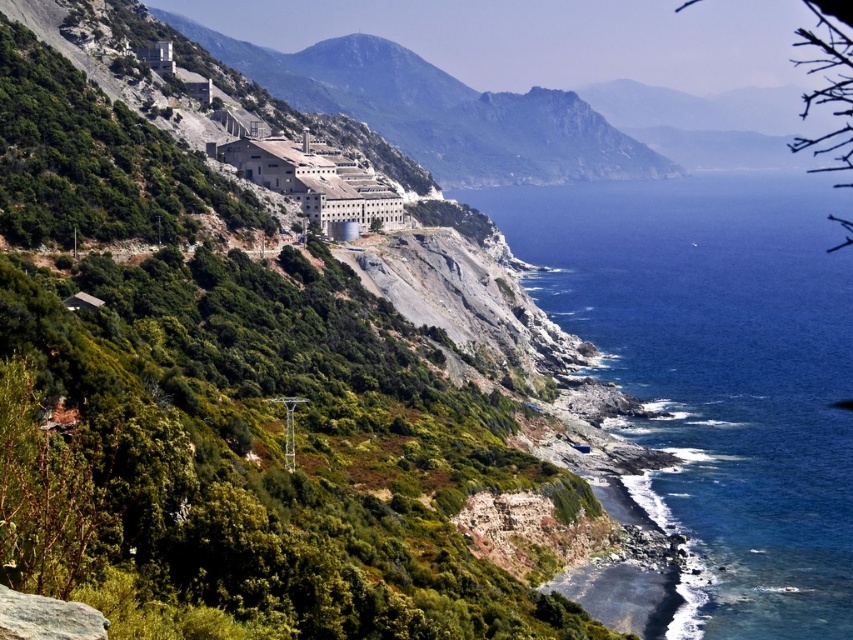
Is blue water at lower right closer to camera compared to rugged stone mountain at upper center?

Yes, blue water at lower right is in front of rugged stone mountain at upper center.

Who is taller, blue water at lower right or rugged stone mountain at upper center?

blue water at lower right

Who is more forward, (x=625, y=220) or (x=471, y=177)?

Positioned in front is point (x=625, y=220).

Locate an element on the screen. The image size is (853, 640). blue water at lower right is located at coordinates (717, 372).